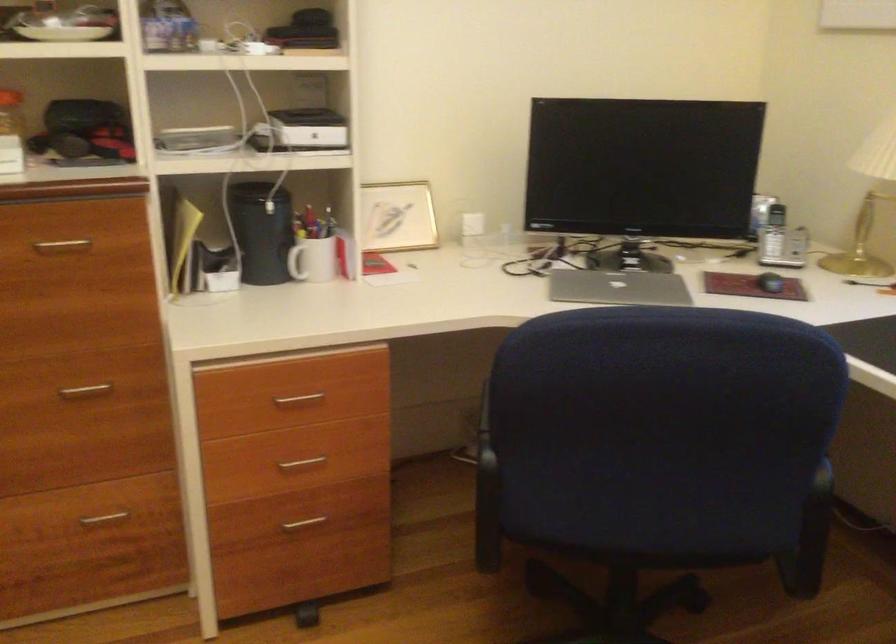
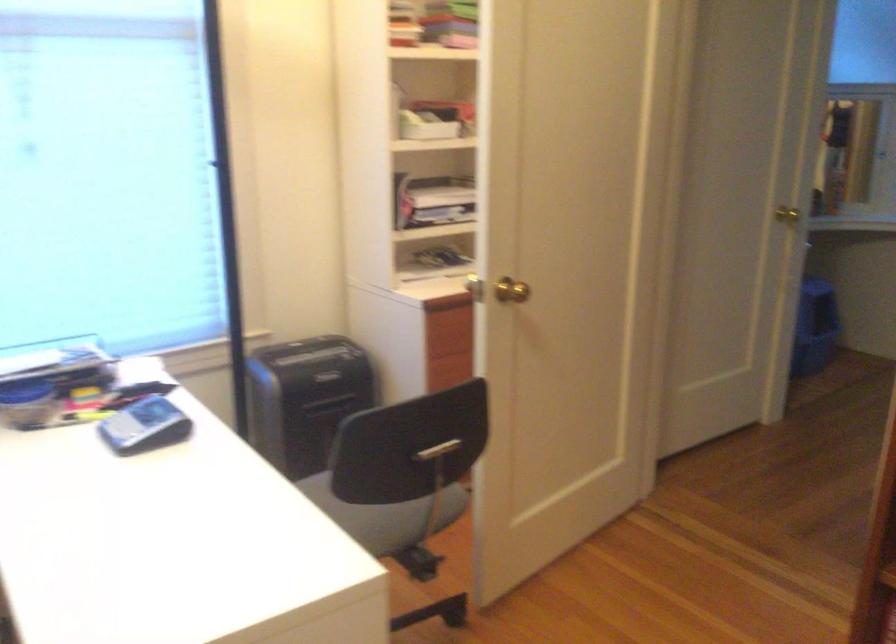
The first image is from the beginning of the video and the second image is from the end. How did the camera likely rotate when shooting the video?

The rotation direction of the camera is right-down.